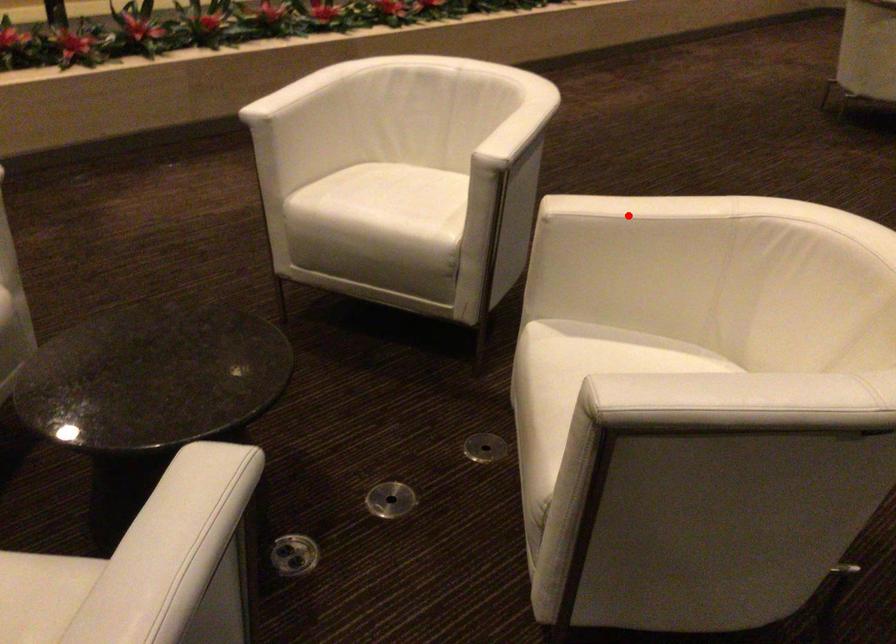
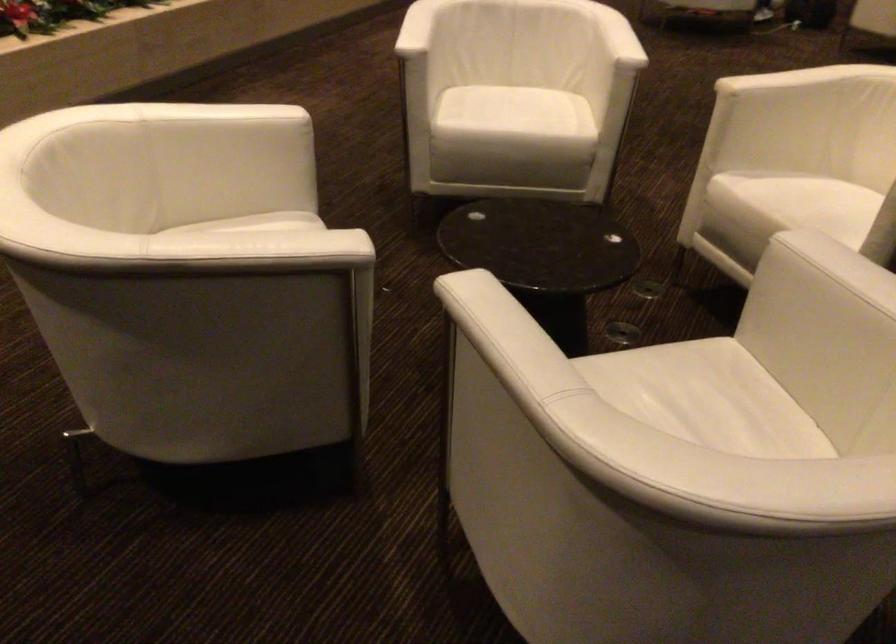
Question: I am providing you with two images of the same scene from different viewpoints. Given a red point in image1, look at the same physical point in image2. Is it:

Choices:
 (A) Closer to the viewpoint
 (B) Farther from the viewpoint

Answer: (B)